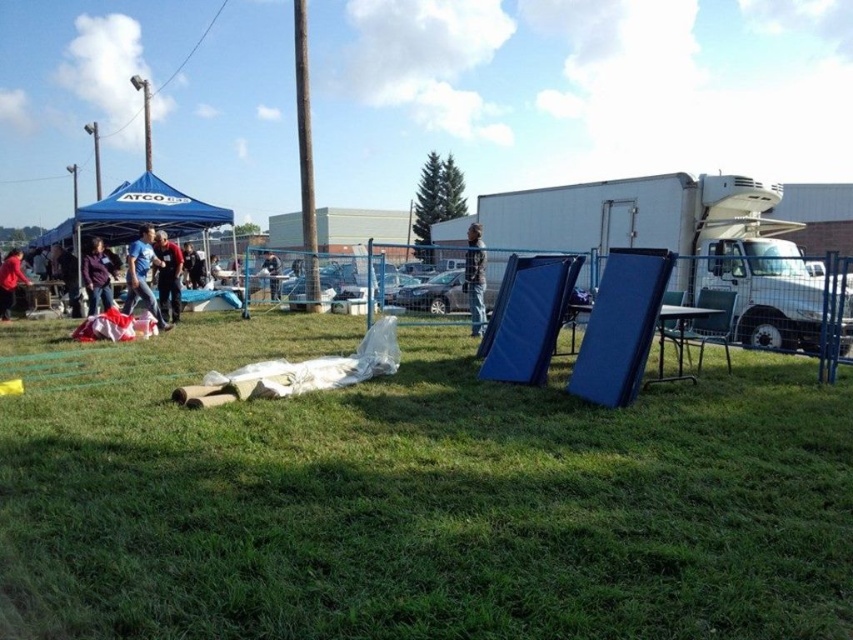
Question: Is blue plastic chair at center to the left of blue fabric canopy at upper left from the viewer's perspective?

Choices:
 (A) yes
 (B) no

Answer: (B)

Question: Which object is positioned closest to the red fabric bag at lower left?

Choices:
 (A) dark blue jeans at center
 (B) green grassy at center
 (C) metallic pole at center

Answer: (A)

Question: Which object is the farthest from the blue plaid shirt at center?

Choices:
 (A) blue fabric canopy at upper left
 (B) blue fabric at left
 (C) red shirt at center
 (D) black leather jacket at center

Answer: (A)

Question: Does blue plastic chair at center appear on the left side of blue fabric chair at center?

Choices:
 (A) yes
 (B) no

Answer: (B)

Question: Can you confirm if metallic pole at center is bigger than red fabric bag at lower left?

Choices:
 (A) no
 (B) yes

Answer: (B)

Question: Which object is the closest to the metallic pole at center?

Choices:
 (A) blue fabric chair at center
 (B) green grassy at center

Answer: (A)